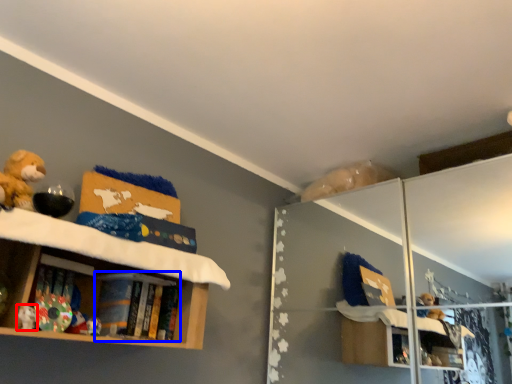
Question: Which of the following is the farthest to the observer, toy (highlighted by a red box) or book (highlighted by a blue box)?

Choices:
 (A) toy
 (B) book

Answer: (B)